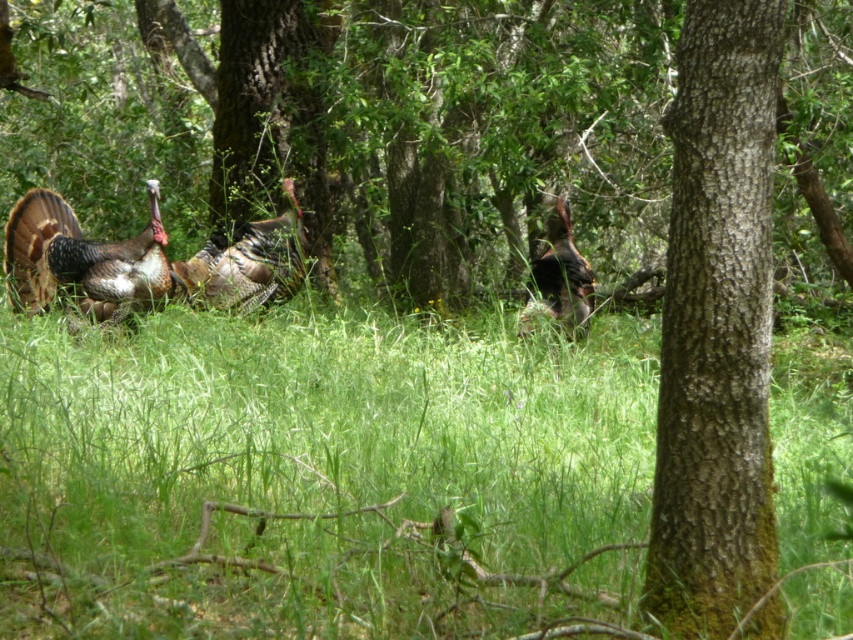
Is point (798, 406) in front of point (561, 298)?

Yes, it is in front of point (561, 298).

Who is more distant from viewer, (x=115, y=538) or (x=569, y=220)?

Point (x=569, y=220)

You are a GUI agent. You are given a task and a screenshot of the screen. Output one action in this format:
    pyautogui.click(x=<x>, y=<y>)
    Task: Click on the green grass at center
    This screenshot has height=640, width=853.
    Given the screenshot: What is the action you would take?
    pyautogui.click(x=321, y=474)

In the scene shown: Can you confirm if shiny brown turkey at left is shorter than shiny brown turkey at center?

Yes.

Between shiny brown turkey at left and shiny brown turkey at center, which one is positioned lower?

Positioned lower is shiny brown turkey at left.

The image size is (853, 640). Describe the element at coordinates (80, 259) in the screenshot. I see `shiny brown turkey at left` at that location.

The image size is (853, 640). I want to click on shiny brown turkey at left, so click(80, 259).

Consider the image. Which is more to the right, green rough bark tree at center or shiny brown turkey at center?

From the viewer's perspective, shiny brown turkey at center appears more on the right side.

Does green rough bark tree at center appear under shiny brown turkey at center?

Indeed, green rough bark tree at center is positioned under shiny brown turkey at center.

The image size is (853, 640). Identify the location of green rough bark tree at center. (717, 326).